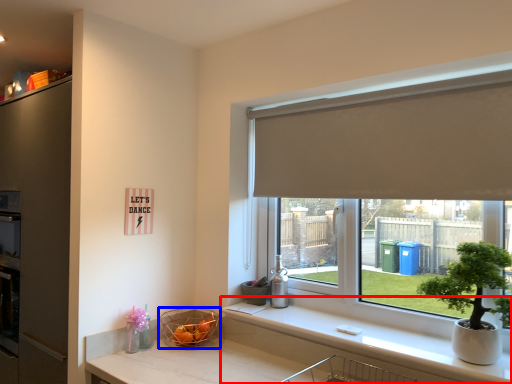
Question: Which of the following is the farthest to the observer, counter top (highlighted by a red box) or basket (highlighted by a blue box)?

Choices:
 (A) counter top
 (B) basket

Answer: (B)